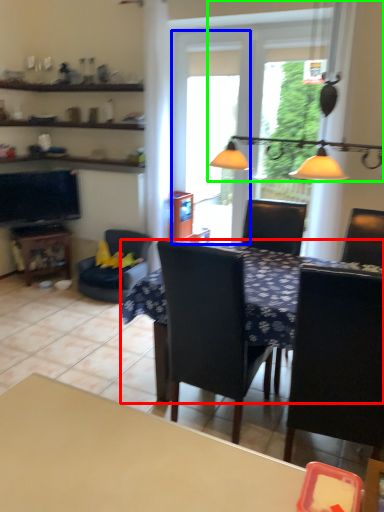
Question: Based on their relative distances, which object is nearer to table (highlighted by a red box)? Choose from screen door (highlighted by a blue box) and light fixture (highlighted by a green box).

Choices:
 (A) screen door
 (B) light fixture

Answer: (B)